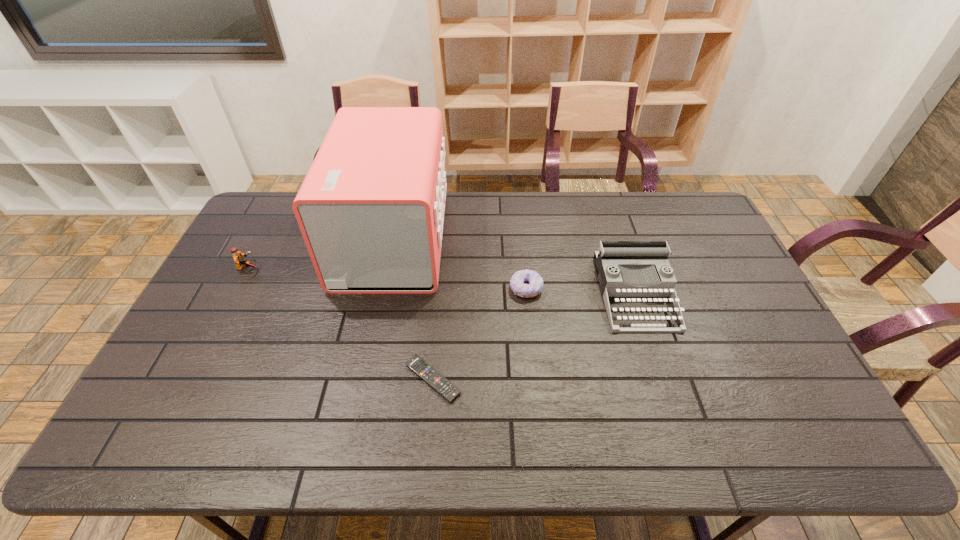
Find the location of a particular element. This screenshot has height=540, width=960. vacant area that lies between the fourth object from left to right and the typewriter is located at coordinates (581, 291).

Locate an element on the screen. The height and width of the screenshot is (540, 960). vacant region between the fourth tallest object and the nearest object is located at coordinates (479, 334).

Find the location of a particular element. This screenshot has width=960, height=540. vacant area that lies between the box and the second object from right to left is located at coordinates (460, 264).

Where is `vacant area that lies between the remote control and the second shortest object`? The width and height of the screenshot is (960, 540). vacant area that lies between the remote control and the second shortest object is located at coordinates (479, 334).

Locate an element on the screen. vacant region between the typewriter and the second shortest object is located at coordinates (581, 291).

Choose which object is the nearest neighbor to the doughnut. Please provide its 2D coordinates. Your answer should be formatted as a tuple, i.e. [(x, y)], where the tuple contains the x and y coordinates of a point satisfying the conditions above.

[(616, 261)]

At what (x,y) coordinates should I click in order to perform the action: click on the fourth closest object to the fourth shortest object. Please return your answer as a coordinate pair (x, y). Looking at the image, I should click on (238, 258).

Locate an element on the screen. The image size is (960, 540). blank space that satisfies the following two spatial constraints: 1. holding a crossbow in the hands of the second shortest object; 2. on the right side of the Lego is located at coordinates (238, 288).

The image size is (960, 540). Identify the location of vacant region that satisfies the following two spatial constraints: 1. holding a crossbow in the hands of the shortest object; 2. on the left side of the Lego. (191, 379).

Find the location of a particular element. The width and height of the screenshot is (960, 540). vacant point that satisfies the following two spatial constraints: 1. on the back side of the remote control; 2. on the surface of the tallest object where the text is embossed is located at coordinates (444, 238).